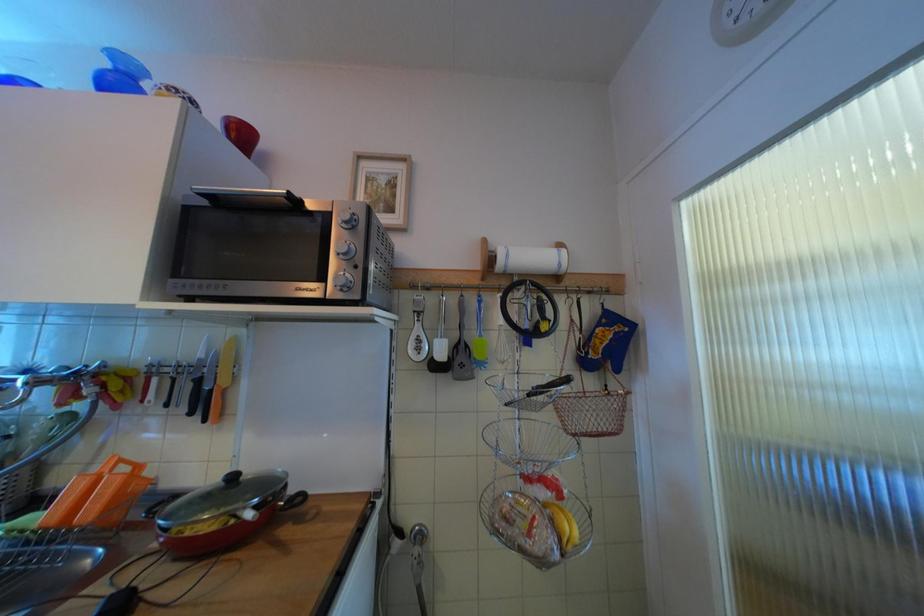
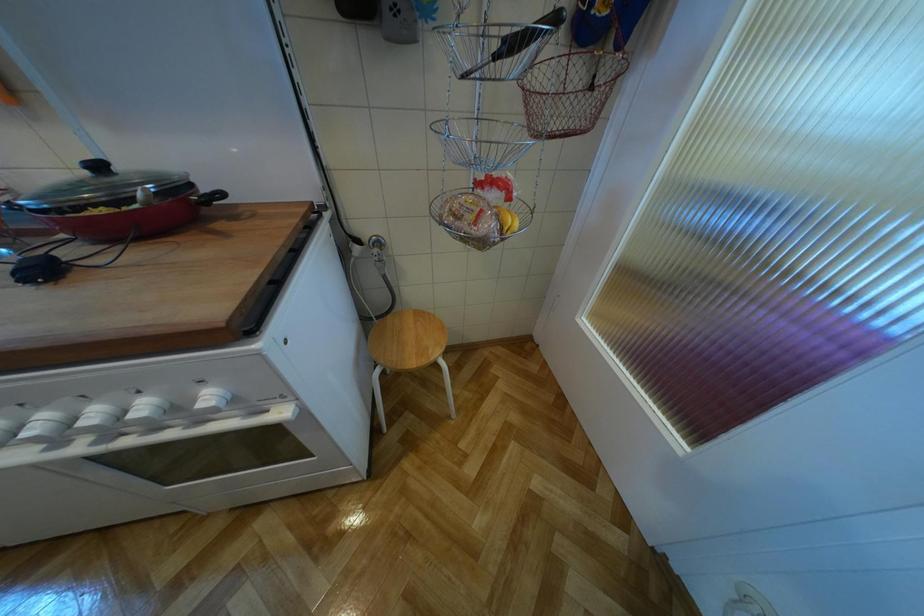
Question: Based on the continuous images, in which direction is the camera rotating? Reply with the corresponding letter.

Choices:
 (A) Left
 (B) Right
 (C) Up
 (D) Down

Answer: (D)